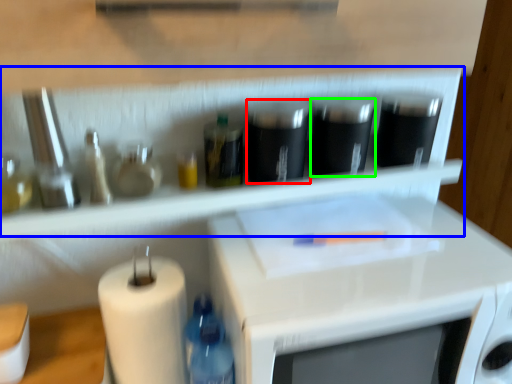
Question: Considering the real-world distances, which object is farthest from appliance (highlighted by a red box)? shelf (highlighted by a blue box) or appliance (highlighted by a green box)?

Choices:
 (A) shelf
 (B) appliance

Answer: (A)